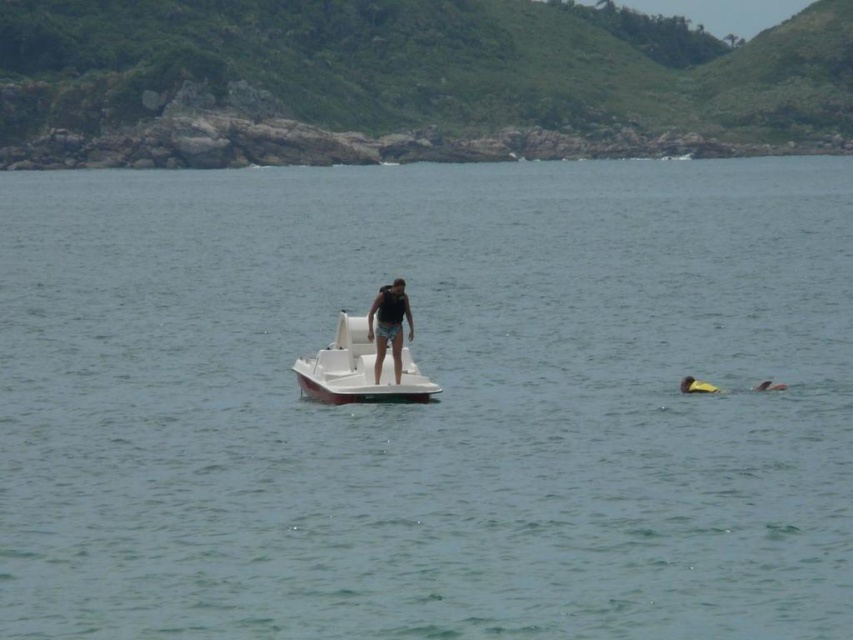
Between white matte boat at center and matte black tank top at center, which one is positioned higher?

matte black tank top at center

Is point (360, 371) positioned in front of point (370, 330)?

That is False.

Which is behind, point (392, 396) or point (381, 356)?

Positioned behind is point (381, 356).

This screenshot has width=853, height=640. I want to click on white matte boat at center, so click(x=358, y=371).